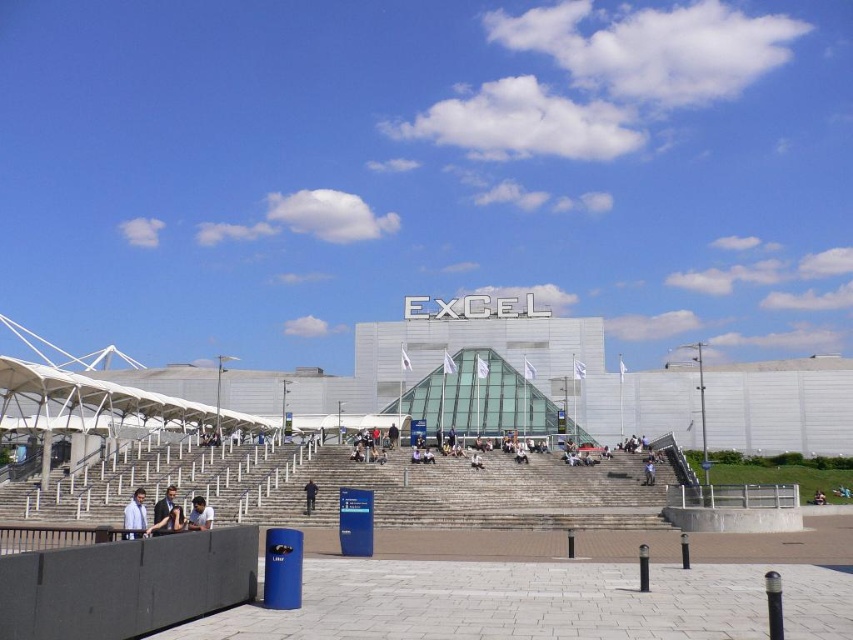
Can you confirm if light blue shirt at lower left is positioned to the right of dark blue jeans at center?

Incorrect, light blue shirt at lower left is not on the right side of dark blue jeans at center.

Based on the photo, who is positioned more to the right, light blue shirt at lower left or dark blue jeans at center?

From the viewer's perspective, dark blue jeans at center appears more on the right side.

Is point (132, 536) farther from camera compared to point (822, 500)?

No, (132, 536) is closer to viewer.

Where is `light blue shirt at lower left`? Image resolution: width=853 pixels, height=640 pixels. light blue shirt at lower left is located at coordinates (135, 515).

In the scene shown: Can you confirm if dark blue fabric at center is bigger than blue fabric person at center?

Indeed, dark blue fabric at center has a larger size compared to blue fabric person at center.

What do you see at coordinates (309, 497) in the screenshot? I see `dark blue fabric at center` at bounding box center [309, 497].

I want to click on dark blue fabric at center, so click(x=309, y=497).

Who is taller, gray concrete stairs at center or dark blue fabric at center?

gray concrete stairs at center is taller.

Who is more forward, [502,456] or [306,483]?

Point [306,483]

Identify the location of gray concrete stairs at center. The height and width of the screenshot is (640, 853). (440, 492).